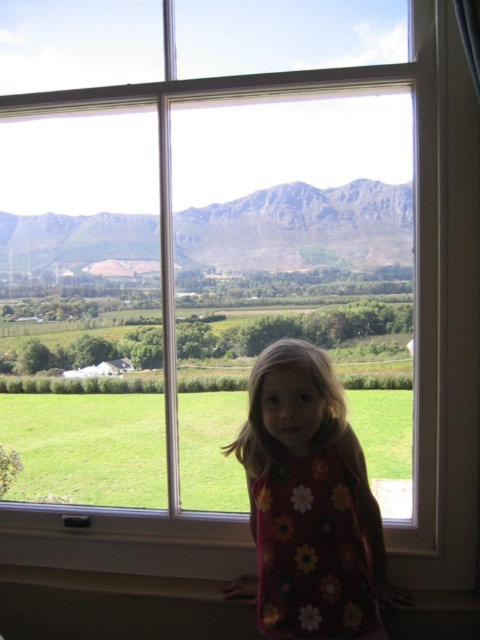
Does point (349, 429) lie behind point (243, 220)?

No.

Can you confirm if floral fabric dress at center is positioned above rocky gray mountain at center?

Actually, floral fabric dress at center is below rocky gray mountain at center.

Describe the element at coordinates (310, 502) in the screenshot. This screenshot has width=480, height=640. I see `floral fabric dress at center` at that location.

The height and width of the screenshot is (640, 480). I want to click on floral fabric dress at center, so click(x=310, y=502).